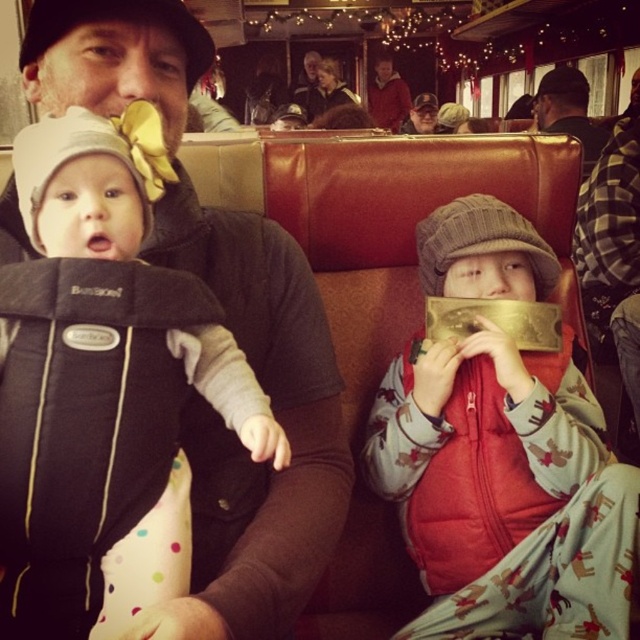
Does point (609, 563) lie behind point (108, 579)?

That is True.

Does point (545, 284) lie in front of point (157, 531)?

No, (545, 284) is further to viewer.

Does point (552, 600) come closer to viewer compared to point (93, 188)?

That is False.

Where is `red fleece vest at center`? The width and height of the screenshot is (640, 640). red fleece vest at center is located at coordinates (504, 492).

Measure the distance from red fleece vest at center to matte black jacket at center.

A distance of 2.39 meters exists between red fleece vest at center and matte black jacket at center.

Who is more forward, (408, 474) or (557, 106)?

Positioned in front is point (408, 474).

Is point (586, 584) behind point (570, 81)?

No.

Identify the location of red fleece vest at center. This screenshot has width=640, height=640. (504, 492).

Who is lower down, soft black fabric baby carrier at left or matte black jacket at center?

Positioned lower is soft black fabric baby carrier at left.

This screenshot has width=640, height=640. What do you see at coordinates (90, 180) in the screenshot?
I see `soft black fabric baby carrier at left` at bounding box center [90, 180].

Measure the distance between point [74,170] and camera.

The distance of point [74,170] from camera is 24.81 inches.

Identify the location of soft black fabric baby carrier at left. (90, 180).